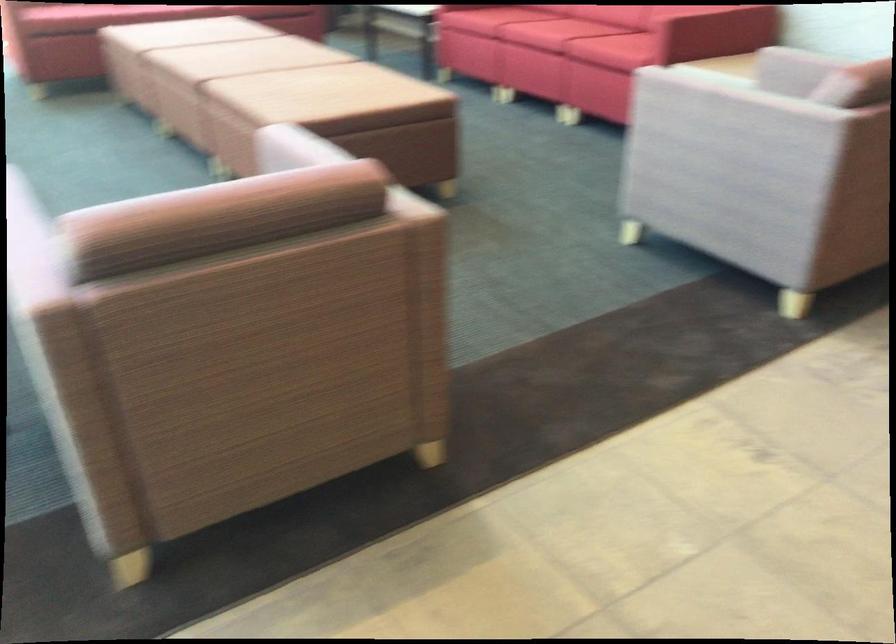
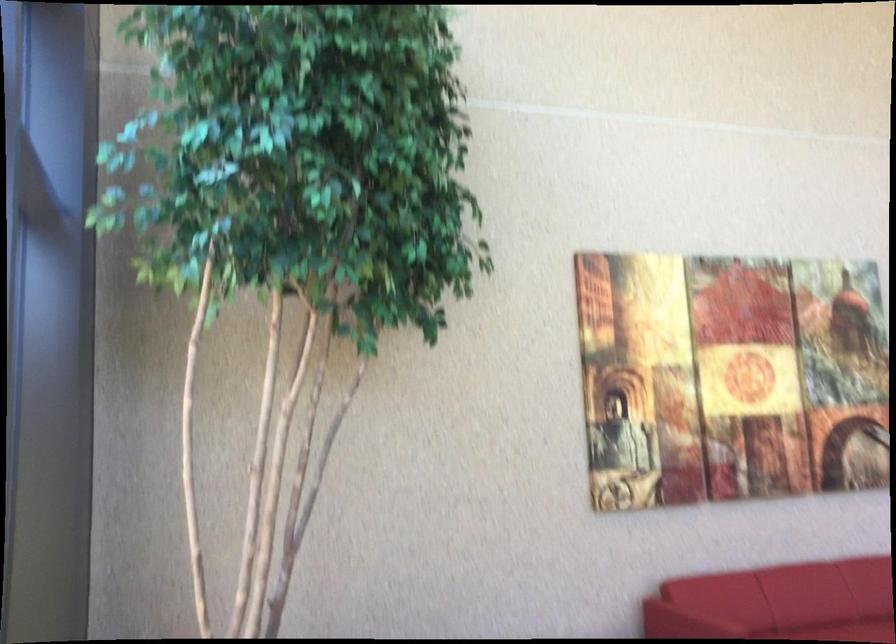
Question: The images are taken continuously from a first-person perspective. In which direction are you moving?

Choices:
 (A) Left
 (B) Right
 (C) Forward
 (D) Backward

Answer: (D)